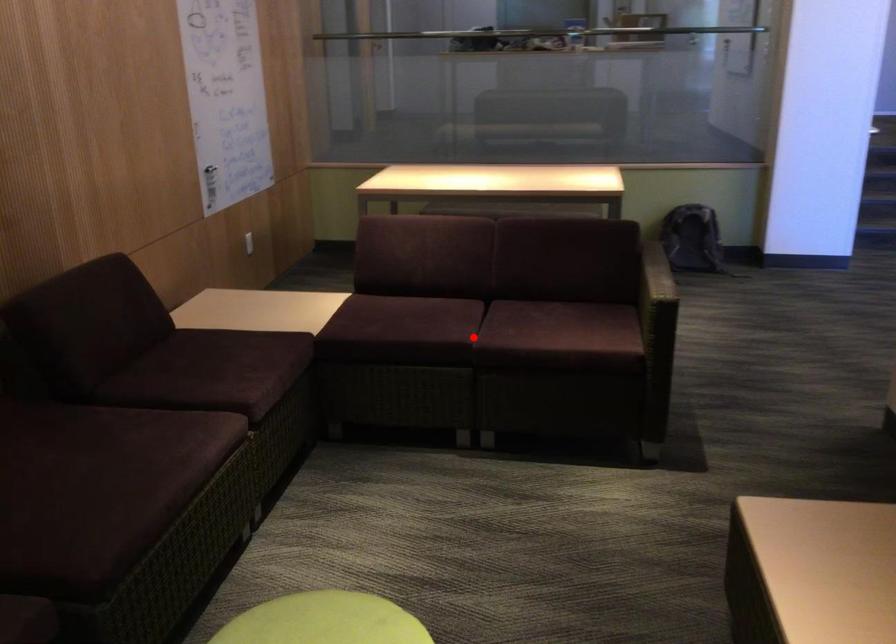
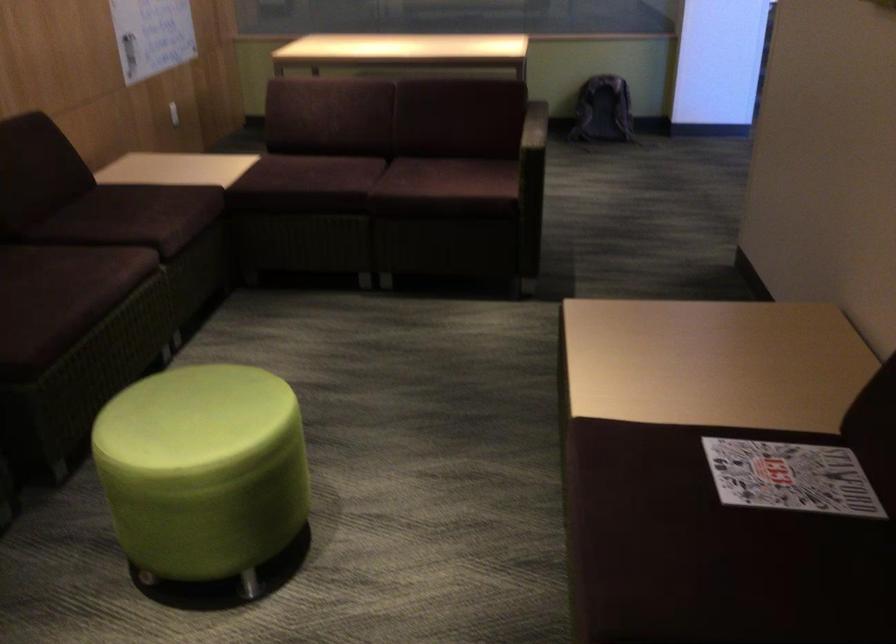
In the second image, find the point that corresponds to the highlighted location in the first image.

(371, 185)